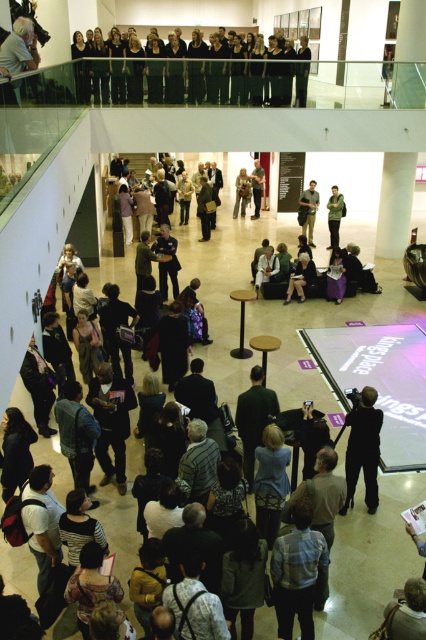
Question: Which of the following is the closest to the observer?

Choices:
 (A) (264, 52)
 (B) (367, 433)
 (C) (256, 176)
 (D) (311, 237)

Answer: (B)

Question: Where is black fabric crowd at upper center located in relation to dark gray fabric jacket at center in the image?

Choices:
 (A) right
 (B) left

Answer: (B)

Question: Which of these objects is positioned farthest from the dark gray suit at center?

Choices:
 (A) dark gray fabric jacket at center
 (B) light brown fabric jacket at center

Answer: (B)

Question: Does light brown fabric jacket at center appear on the right side of light brown leather jacket at center?

Choices:
 (A) no
 (B) yes

Answer: (A)

Question: Considering the relative positions of dark gray fabric jacket at center and light brown fabric jacket at center in the image provided, where is dark gray fabric jacket at center located with respect to light brown fabric jacket at center?

Choices:
 (A) left
 (B) right

Answer: (B)

Question: Which of the following is the farthest from the observer?

Choices:
 (A) black fabric crowd at upper center
 (B) dark gray fabric jacket at center

Answer: (B)